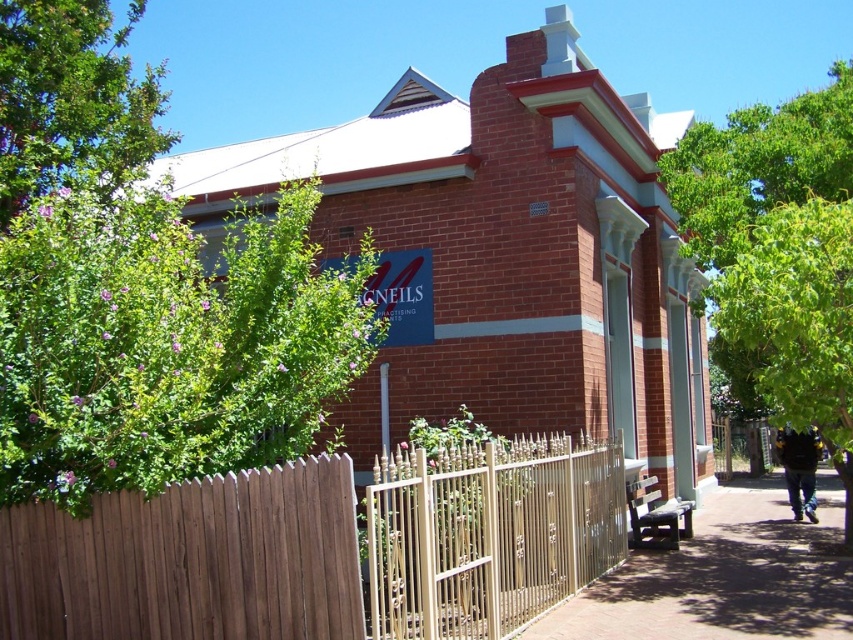
Based on the photo, you are standing on the sidewalk in front of the brick building and want to take a photo of the blue sign. Which object, the green leafy bush at left or the green leafy tree at upper left, is closer to you and might block your view?

The green leafy bush at left is closer to the viewer than the green leafy tree at upper left, so it might block your view of the blue sign.

You are standing in front of the brick building and want to walk to the sidewalk. Which direction should you move relative to the brown wooden fence at lower center?

Since the brown wooden fence at lower center is located at point (190, 561), you should move away from it to reach the sidewalk.